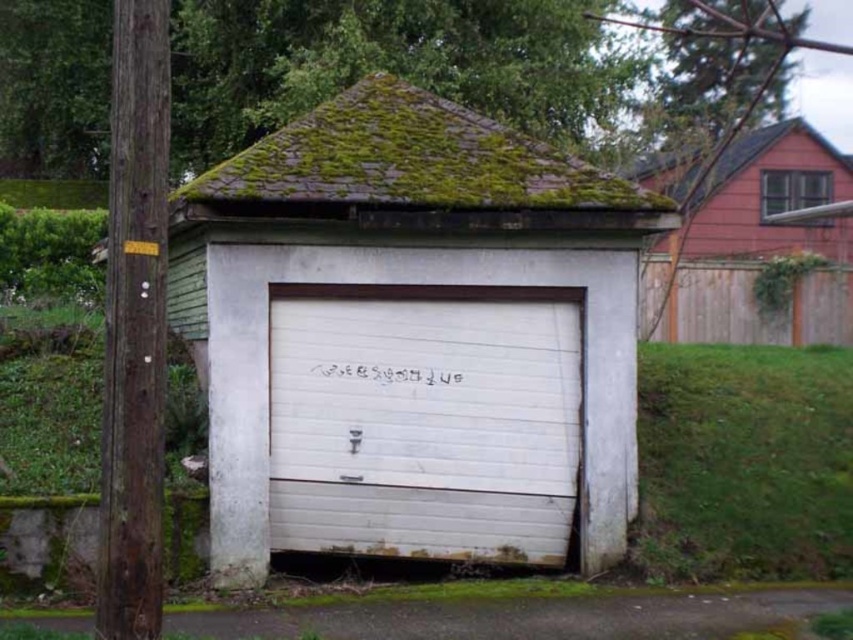
You are a painter standing in front of the white painted wood garage door at center and the red wood fence at upper right. You want to paint both structures but need to know which one you should paint first. Which structure should you paint first based on their positions?

The white painted wood garage door at center is closer to the viewer than the red wood fence at upper right, so you should paint the white painted wood garage door at center first before moving to the farther red wood fence at upper right.

Consider the image. You are standing in front of the garage and need to locate the white matte garage door at center. According to the coordinates provided, where exactly is it positioned?

The white matte garage door at center is located at point coordinates of 0.528 on the x axis and 0.485 on the y axis.